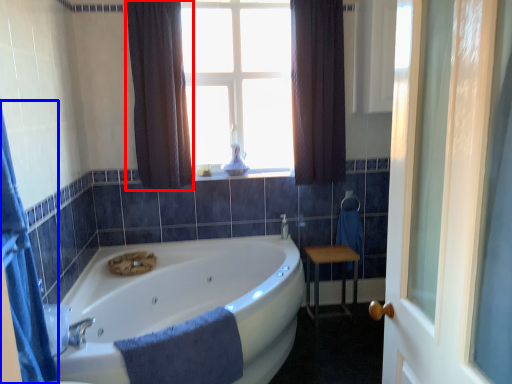
Question: Which point is further to the camera, curtain (highlighted by a red box) or shower curtain (highlighted by a blue box)?

Choices:
 (A) curtain
 (B) shower curtain

Answer: (A)